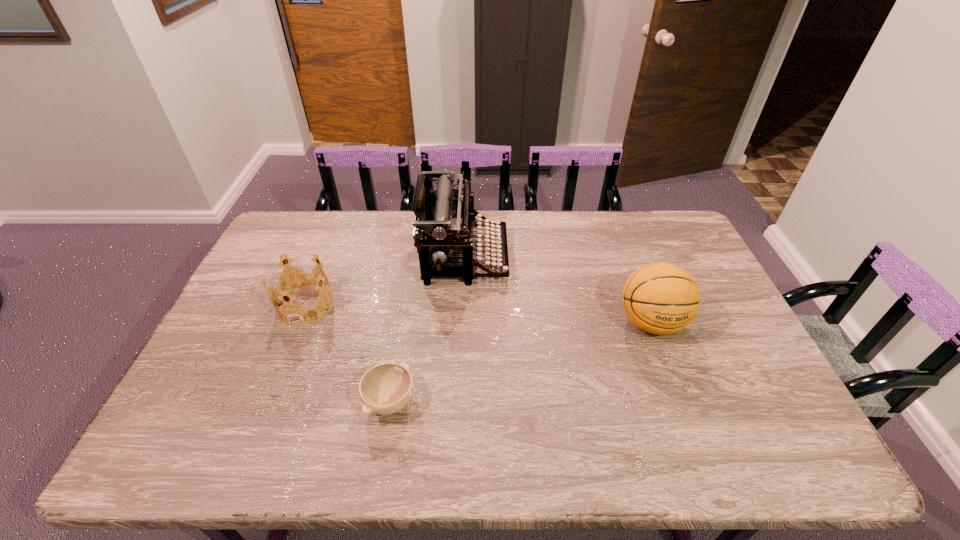
At what (x,y) coordinates should I click in order to perform the action: click on the tallest object. Please return your answer as a coordinate pair (x, y). Image resolution: width=960 pixels, height=540 pixels. Looking at the image, I should click on (444, 222).

Where is `basketball`? basketball is located at coordinates pyautogui.click(x=661, y=298).

What are the coordinates of `the rightmost object` in the screenshot? It's located at (661, 298).

Where is `the leftmost object`? the leftmost object is located at coordinates (296, 282).

Find the location of a particular element. The width and height of the screenshot is (960, 540). crown is located at coordinates (296, 282).

The height and width of the screenshot is (540, 960). What are the coordinates of `the shortest object` in the screenshot? It's located at (386, 388).

Where is `bowl`? bowl is located at coordinates (386, 388).

The image size is (960, 540). I want to click on vacant space situated 0.390m on the typing side of the typewriter, so click(621, 256).

Locate an element on the screen. This screenshot has width=960, height=540. free location located 0.180m on the surface of the third shortest object near the brand logo is located at coordinates (683, 408).

Find the location of a particular element. Image resolution: width=960 pixels, height=540 pixels. free space located on the right of the crown is located at coordinates (461, 305).